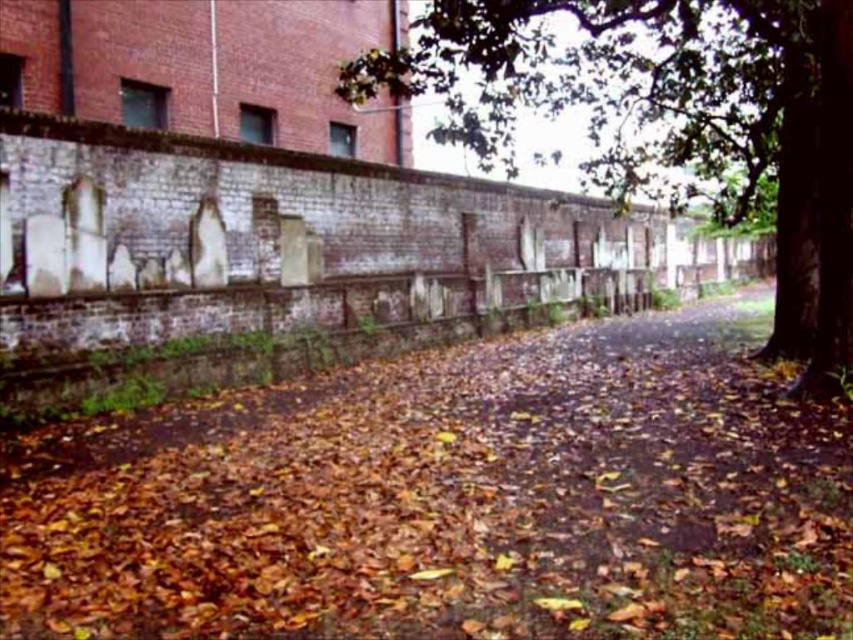
Question: Which point is closer to the camera taking this photo?

Choices:
 (A) (786, 51)
 (B) (262, 426)

Answer: (B)

Question: Does brown leafy dirt at center have a lesser width compared to green leafy tree at center?

Choices:
 (A) no
 (B) yes

Answer: (B)

Question: From the image, what is the correct spatial relationship of brown leafy dirt at center in relation to green leafy tree at center?

Choices:
 (A) below
 (B) above

Answer: (A)

Question: Which of the following is the farthest from the observer?

Choices:
 (A) (321, 442)
 (B) (611, 189)

Answer: (B)

Question: Can you confirm if brown leafy dirt at center is positioned below green leafy tree at center?

Choices:
 (A) yes
 (B) no

Answer: (A)

Question: Which point appears closest to the camera in this image?

Choices:
 (A) (480, 42)
 (B) (538, 355)

Answer: (A)